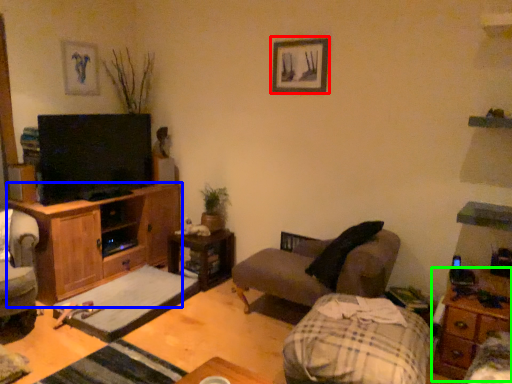
Question: Considering the real-world distances, which object is farthest from picture frame (highlighted by a red box)? cabinetry (highlighted by a blue box) or nightstand (highlighted by a green box)?

Choices:
 (A) cabinetry
 (B) nightstand

Answer: (B)